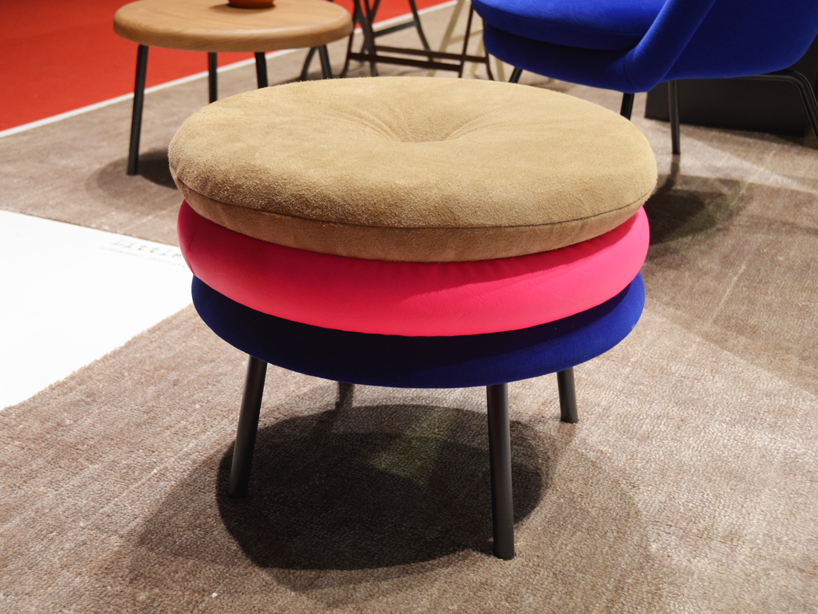
At what (x,y) coordinates should I click in order to perform the action: click on seat. Please return your answer as a coordinate pair (x, y). This screenshot has height=614, width=818. Looking at the image, I should click on (546, 174).